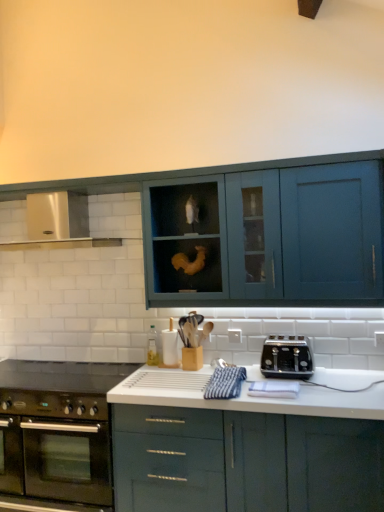
Question: From the image's perspective, would you say black glass gas stove at lower left is shown under stainless steel oven at lower left?

Choices:
 (A) yes
 (B) no

Answer: (B)

Question: Can you confirm if black glass gas stove at lower left is taller than stainless steel oven at lower left?

Choices:
 (A) yes
 (B) no

Answer: (B)

Question: Considering the relative sizes of black glass gas stove at lower left and stainless steel oven at lower left in the image provided, is black glass gas stove at lower left thinner than stainless steel oven at lower left?

Choices:
 (A) no
 (B) yes

Answer: (B)

Question: Would you say black glass gas stove at lower left is outside stainless steel oven at lower left?

Choices:
 (A) yes
 (B) no

Answer: (A)

Question: Is black glass gas stove at lower left facing away from stainless steel oven at lower left?

Choices:
 (A) yes
 (B) no

Answer: (B)

Question: From the image's perspective, is matte blue cabinet at upper center, which appears as the second cabinetry when ordered from the bottom, above or below stainless steel oven at lower left?

Choices:
 (A) above
 (B) below

Answer: (A)

Question: In the image, is matte blue cabinet at upper center, which ranks as the 1th cabinetry in top-to-bottom order, positioned in front of or behind stainless steel oven at lower left?

Choices:
 (A) behind
 (B) front

Answer: (B)

Question: Is matte blue cabinet at upper center, which appears as the second cabinetry when ordered from the bottom, bigger or smaller than stainless steel oven at lower left?

Choices:
 (A) big
 (B) small

Answer: (B)

Question: Considering the positions of matte blue cabinet at upper center, which ranks as the 1th cabinetry in top-to-bottom order, and stainless steel oven at lower left in the image, is matte blue cabinet at upper center, which ranks as the 1th cabinetry in top-to-bottom order, wider or thinner than stainless steel oven at lower left?

Choices:
 (A) thin
 (B) wide

Answer: (A)

Question: Is point (26, 379) positioned closer to the camera than point (99, 442)?

Choices:
 (A) closer
 (B) farther

Answer: (B)

Question: In the image, is black glass gas stove at lower left positioned in front of or behind stainless steel oven at lower left?

Choices:
 (A) front
 (B) behind

Answer: (B)

Question: Considering the positions of black glass gas stove at lower left and stainless steel oven at lower left in the image, is black glass gas stove at lower left bigger or smaller than stainless steel oven at lower left?

Choices:
 (A) small
 (B) big

Answer: (A)

Question: From a real-world perspective, relative to stainless steel oven at lower left, is black glass gas stove at lower left vertically above or below?

Choices:
 (A) above
 (B) below

Answer: (A)

Question: Is point (56, 241) closer or farther from the camera than point (112, 372)?

Choices:
 (A) farther
 (B) closer

Answer: (B)

Question: Is satin silver exhaust hood at upper left to the left or to the right of black glass gas stove at lower left in the image?

Choices:
 (A) right
 (B) left

Answer: (B)